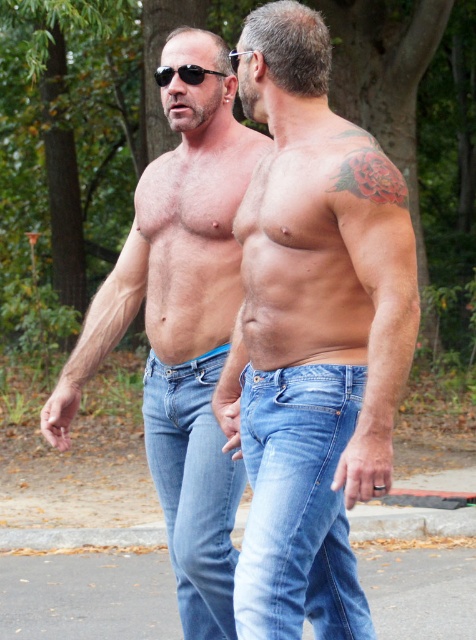
Question: Is smooth skin torso at center to the left of denim jeans at lower right from the viewer's perspective?

Choices:
 (A) yes
 (B) no

Answer: (B)

Question: Estimate the real-world distances between objects in this image. Which object is farther from the smooth skin torso at center?

Choices:
 (A) denim jeans at lower right
 (B) matte blue jeans at center
 (C) black plastic sunglasses at upper center
 (D) denim jeans at center

Answer: (C)

Question: Which of the following is the closest to the observer?

Choices:
 (A) (219, 307)
 (B) (344, 570)

Answer: (B)

Question: Is smooth skin torso at center above denim jeans at lower right?

Choices:
 (A) yes
 (B) no

Answer: (A)

Question: Which point is closer to the camera?

Choices:
 (A) (152, 365)
 (B) (157, 442)
 (C) (347, 588)

Answer: (C)

Question: Can you confirm if smooth skin torso at center is bigger than matte blue jeans at center?

Choices:
 (A) no
 (B) yes

Answer: (B)